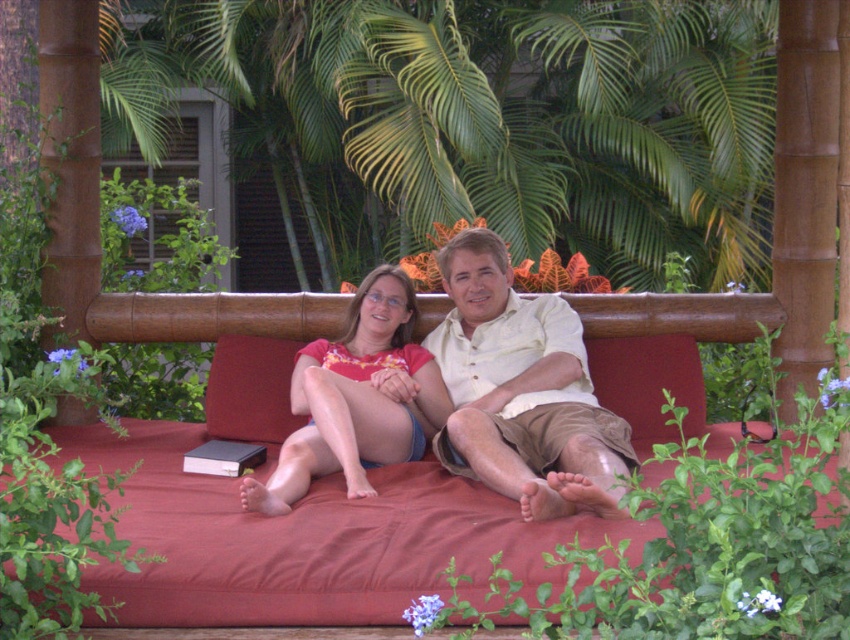
Question: Which point is closer to the camera taking this photo?

Choices:
 (A) (314, 381)
 (B) (581, 362)

Answer: (A)

Question: Which of the following is the closest to the observer?

Choices:
 (A) light beige cotton shirt at center
 (B) matte orange shirt at center

Answer: (A)

Question: Is light beige cotton shirt at center positioned before matte orange shirt at center?

Choices:
 (A) yes
 (B) no

Answer: (A)

Question: Is light beige cotton shirt at center smaller than matte orange shirt at center?

Choices:
 (A) no
 (B) yes

Answer: (A)

Question: From the image, what is the correct spatial relationship of light beige cotton shirt at center in relation to matte orange shirt at center?

Choices:
 (A) right
 (B) left

Answer: (A)

Question: Among these objects, which one is nearest to the camera?

Choices:
 (A) matte orange shirt at center
 (B) light beige cotton shirt at center

Answer: (B)